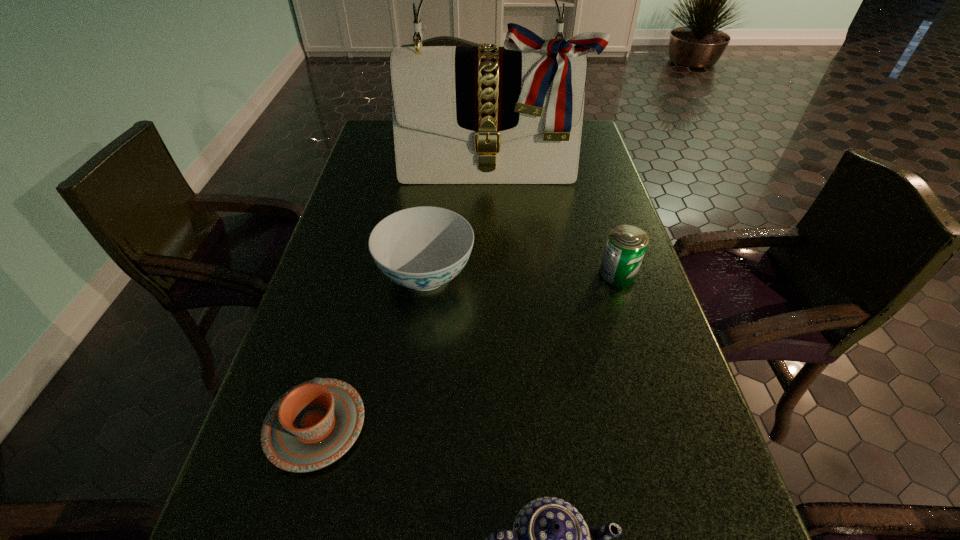
Identify the location of satchel. This screenshot has height=540, width=960. (461, 115).

Identify the location of the farthest object. (461, 115).

Image resolution: width=960 pixels, height=540 pixels. What are the coordinates of `the farthest chinaware` in the screenshot? It's located at (422, 248).

Find the location of a particular element. This screenshot has width=960, height=540. can is located at coordinates pyautogui.click(x=625, y=247).

The image size is (960, 540). I want to click on the shortest object, so click(x=312, y=425).

Locate an element on the screen. Image resolution: width=960 pixels, height=540 pixels. the second farthest chinaware is located at coordinates (312, 425).

You are a GUI agent. You are given a task and a screenshot of the screen. Output one action in this format:
    pyautogui.click(x=<x>, y=<y>)
    Task: Click on the free space located on the front-facing side of the satchel
    
    Given the screenshot: What is the action you would take?
    pyautogui.click(x=496, y=271)

Find the location of a particular element. Image resolution: width=960 pixels, height=540 pixels. vacant area situated 0.260m on the right of the farthest chinaware is located at coordinates (587, 275).

Identify the location of vacant space located 0.390m on the front of the can. (676, 460).

Find the location of `vacant area located on the handle side of the shortest chinaware`. vacant area located on the handle side of the shortest chinaware is located at coordinates (341, 335).